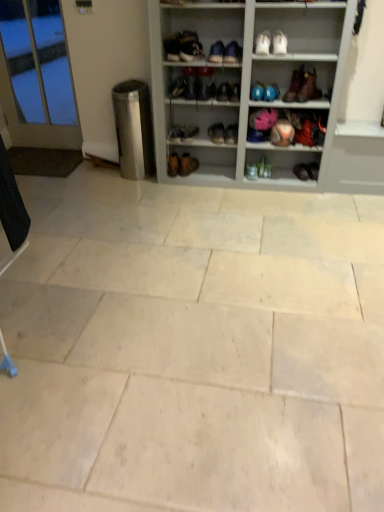
Question: From their relative heights in the image, would you say matte black shoe at center, the 4th shoe when ordered from left to right, is taller or shorter than brown leather boot at upper right, the 9th footwear when ordered from left to right?

Choices:
 (A) tall
 (B) short

Answer: (B)

Question: In the image, is matte black shoe at center, the 4th shoe when ordered from left to right, on the left side or the right side of brown leather boot at upper right, the 2th footwear from the right?

Choices:
 (A) left
 (B) right

Answer: (A)

Question: Which is nearer to the leather boot at center, which appears as the third footwear when viewed from the left?

Choices:
 (A) blue matte shoes at upper center, marked as the 6th footwear in a left-to-right arrangement
 (B) matte black shoe at upper center, which is counted as the 2th footwear, starting from the left
 (C) white leather shoe at upper center, which is the second shoe from left to right
 (D) natural stone tile at center
 (E) matte black shoe at center, which is the 6th shoe from right to left

Answer: (A)

Question: Which is nearer to the matte black boot at upper center, the 7th footwear in the left-to-right sequence?

Choices:
 (A) matte blue shoe at center, the 1th shoe in the right-to-left sequence
 (B) brown leather boot at upper right, the 2th footwear from the right
 (C) clear glass door at left
 (D) brown leather boot at center, marked as the 10th footwear in a right-to-left arrangement
 (E) natural stone tile at center

Answer: (B)